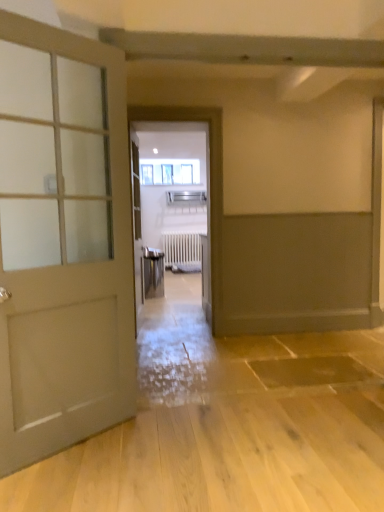
Question: Considering the relative sizes of clear glass window at center and white matte radiator at center in the image provided, is clear glass window at center smaller than white matte radiator at center?

Choices:
 (A) no
 (B) yes

Answer: (A)

Question: Can you confirm if clear glass window at center is taller than white matte radiator at center?

Choices:
 (A) no
 (B) yes

Answer: (A)

Question: Does clear glass window at center appear on the left side of white matte radiator at center?

Choices:
 (A) no
 (B) yes

Answer: (B)

Question: Is clear glass window at center oriented towards white matte radiator at center?

Choices:
 (A) no
 (B) yes

Answer: (A)

Question: From a real-world perspective, is clear glass window at center located higher than white matte radiator at center?

Choices:
 (A) no
 (B) yes

Answer: (B)

Question: Is metallic elevator at center bigger or smaller than matte white door at left?

Choices:
 (A) small
 (B) big

Answer: (B)

Question: From a real-world perspective, is metallic elevator at center positioned above or below matte white door at left?

Choices:
 (A) above
 (B) below

Answer: (A)

Question: From the image's perspective, is metallic elevator at center above or below matte white door at left?

Choices:
 (A) above
 (B) below

Answer: (A)

Question: Visually, is metallic elevator at center positioned to the left or to the right of matte white door at left?

Choices:
 (A) left
 (B) right

Answer: (B)

Question: From a real-world perspective, is clear glass window at center physically located above or below metallic elevator at center?

Choices:
 (A) above
 (B) below

Answer: (A)

Question: Does point (160, 175) appear closer or farther from the camera than point (221, 272)?

Choices:
 (A) farther
 (B) closer

Answer: (A)

Question: Looking at their shapes, would you say clear glass window at center is wider or thinner than metallic elevator at center?

Choices:
 (A) thin
 (B) wide

Answer: (A)

Question: From the image's perspective, is clear glass window at center located above or below metallic elevator at center?

Choices:
 (A) above
 (B) below

Answer: (A)

Question: Is matte white door at left to the left or to the right of metallic elevator at center in the image?

Choices:
 (A) left
 (B) right

Answer: (A)

Question: In terms of width, does matte white door at left look wider or thinner when compared to metallic elevator at center?

Choices:
 (A) thin
 (B) wide

Answer: (A)